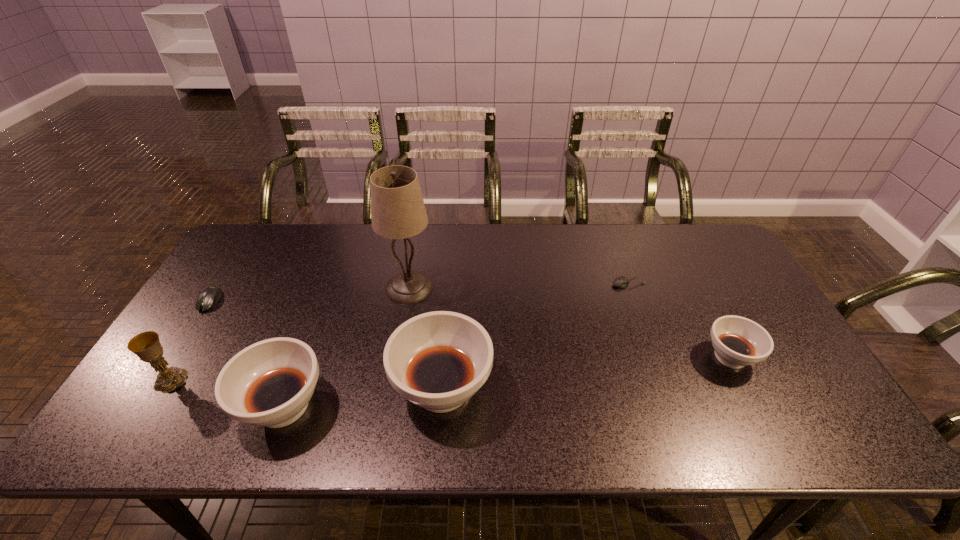
The height and width of the screenshot is (540, 960). I want to click on chalice, so click(146, 345).

Locate an element on the screen. Image resolution: width=960 pixels, height=540 pixels. free space located 0.240m on the right of the second shortest soup bowl is located at coordinates (430, 406).

Where is `free location located on the left of the second soup bowl from right to left`? free location located on the left of the second soup bowl from right to left is located at coordinates (305, 388).

Where is `blank space located on the left of the rightmost soup bowl`? The width and height of the screenshot is (960, 540). blank space located on the left of the rightmost soup bowl is located at coordinates (631, 357).

The width and height of the screenshot is (960, 540). In order to click on vacant space located on the wheel side of the left mouse in this screenshot , I will do `click(177, 352)`.

Find the location of a particular element. The width and height of the screenshot is (960, 540). free location located on the front-facing side of the tallest object is located at coordinates (542, 288).

You are a GUI agent. You are given a task and a screenshot of the screen. Output one action in this format:
    pyautogui.click(x=<x>, y=<y>)
    Task: Click on the blank space located on the front of the second object from right to left
    
    Given the screenshot: What is the action you would take?
    pyautogui.click(x=650, y=342)

This screenshot has height=540, width=960. Find the location of `free space located 0.380m on the right of the chalice`. free space located 0.380m on the right of the chalice is located at coordinates (340, 380).

Find the location of a particular element. The image size is (960, 540). chalice at the near edge is located at coordinates (146, 345).

Locate an element on the screen. This screenshot has width=960, height=540. computer mouse that is at the left edge is located at coordinates pos(209,297).